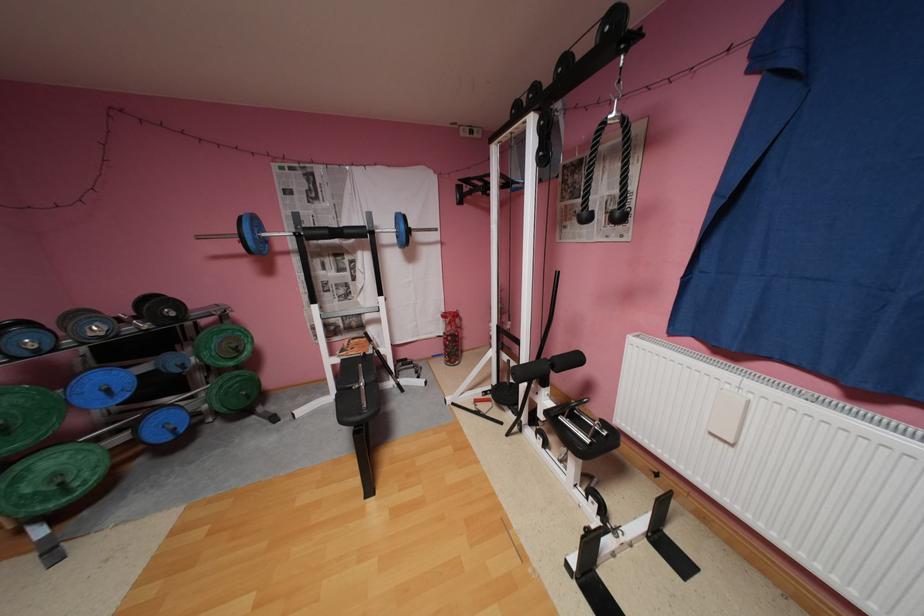
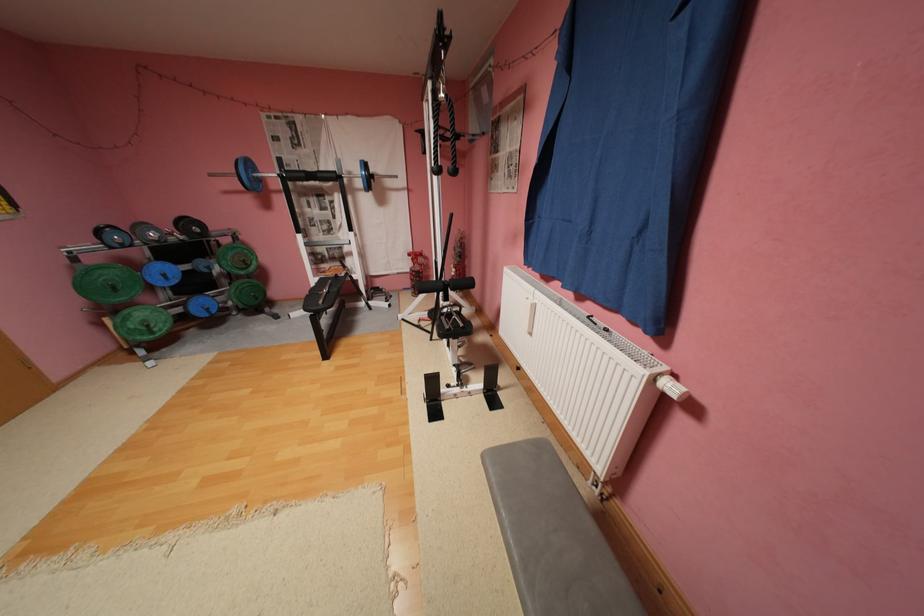
Question: The images are taken continuously from a first-person perspective. In which direction is your viewpoint rotating?

Choices:
 (A) Left
 (B) Right
 (C) Up
 (D) Down

Answer: (D)